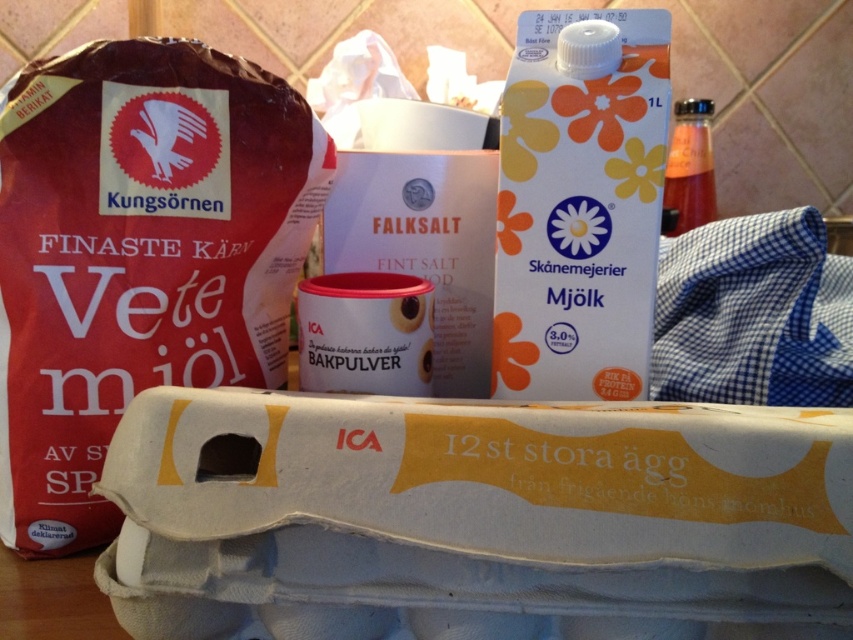
You are standing at the camera position and want to grab the brown paper bag at left. Is it within arm reach?

The brown paper bag at left is 15.18 inches away from camera, so yes, it is within arm reach.

You are arranging groceries on a counter and have a brown paper bag at left and a white paper milk carton at center. Which item is positioned more to the left?

The brown paper bag at left is positioned more to the left than the white paper milk carton at center.

You are organizing the items on the counter and need to place the brown paper bag at left and the white paper milk carton at center into a box that can only hold one of them. Which item should you choose to fit into the box?

The brown paper bag at left is larger in size than the white paper milk carton at center, so the white paper milk carton at center is smaller and would fit into the box.